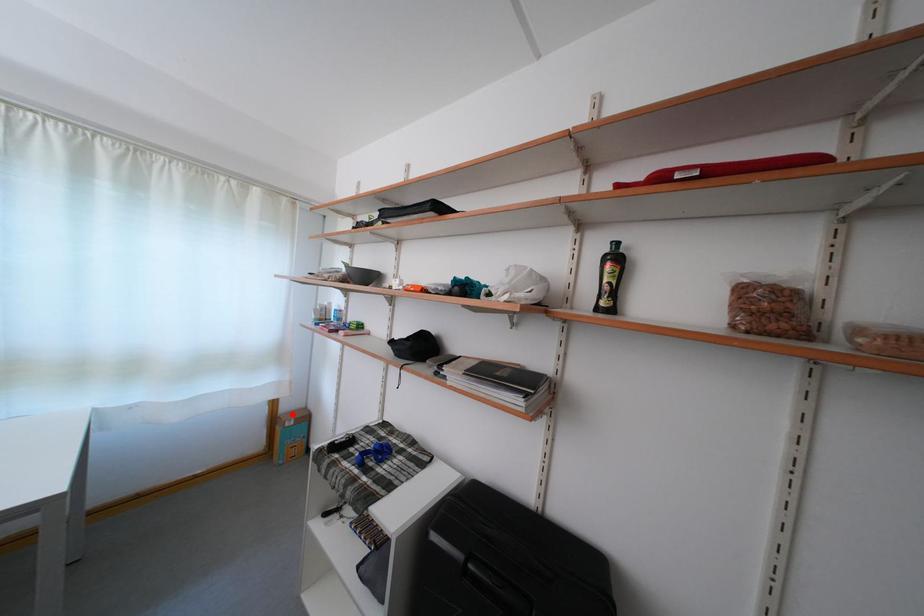
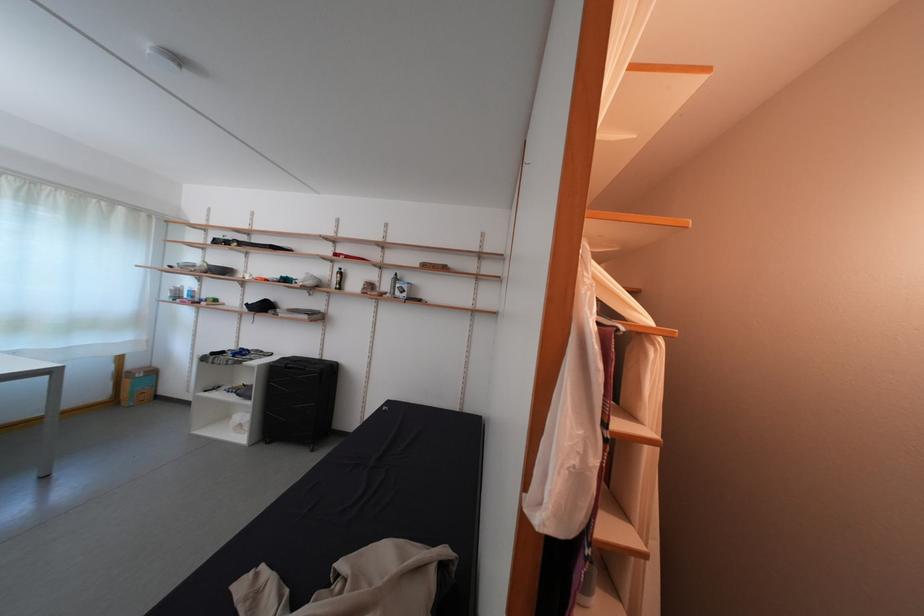
Question: I am providing you with two images of the same scene from different viewpoints. A red point is shown in image1. For the corresponding object point in image2, is it positioned nearer or farther from the camera?

Choices:
 (A) Nearer
 (B) Farther

Answer: (A)